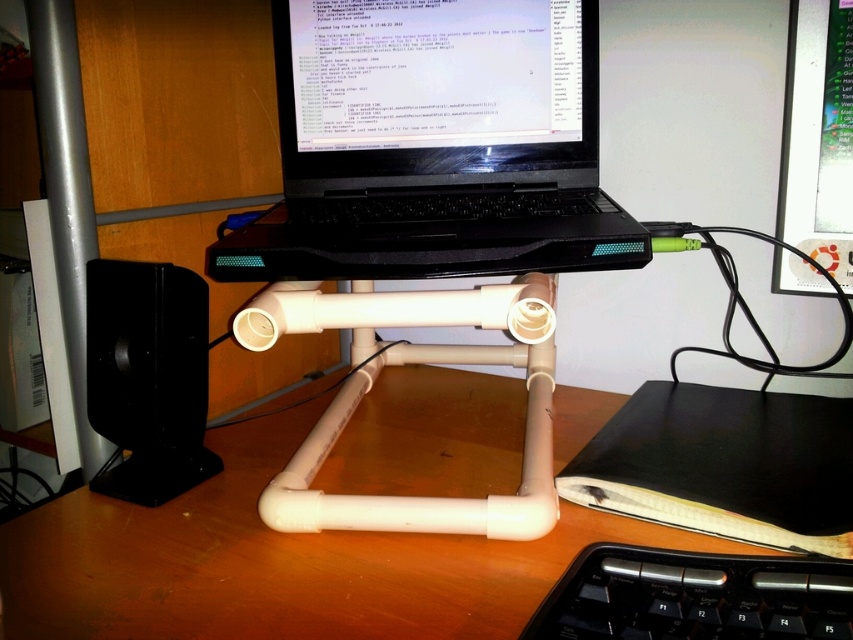
Question: Which point is closer to the camera taking this photo?

Choices:
 (A) (799, 100)
 (B) (550, 4)

Answer: (A)

Question: Is black plastic speaker at left bigger than black plastic keyboard at lower right?

Choices:
 (A) yes
 (B) no

Answer: (A)

Question: Does black glossy laptop at center come behind black plastic keyboard at lower right?

Choices:
 (A) yes
 (B) no

Answer: (A)

Question: Which is farther from the black plastic speaker at left?

Choices:
 (A) black glossy laptop at center
 (B) black plastic keyboard at lower right
 (C) black plastic laptop at center
 (D) matte black monitor at upper right

Answer: (D)

Question: Can you confirm if black glossy laptop at center is positioned below black plastic keyboard at lower right?

Choices:
 (A) no
 (B) yes

Answer: (A)

Question: Which object is the farthest from the black plastic keyboard at lower right?

Choices:
 (A) matte black monitor at upper right
 (B) black plastic laptop at center

Answer: (A)